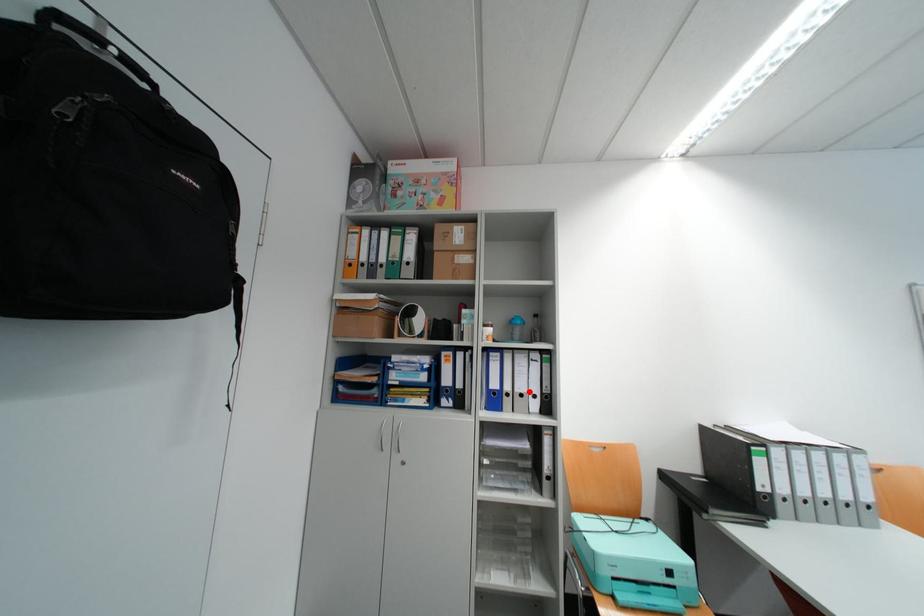
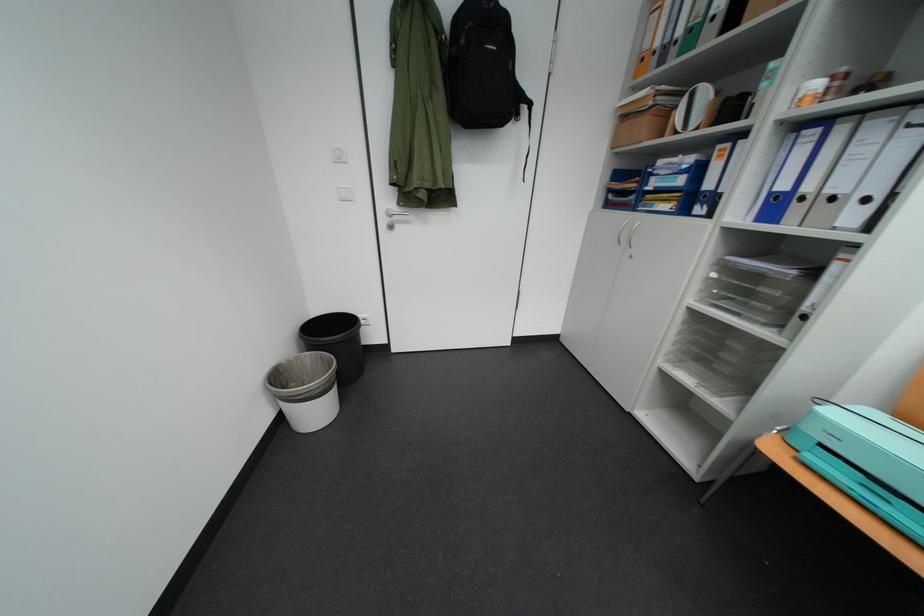
Where in the second image is the point corresponding to the highlighted location from the first image?

(841, 193)